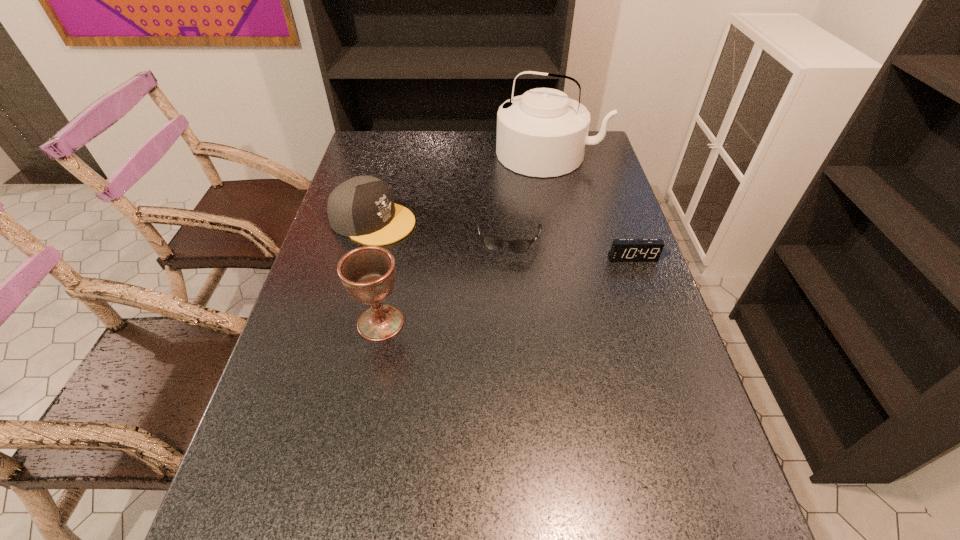
Where is `free space on the desktop that is between the chalice and the alarm clock and is positioned on the front-facing side of the cap`? free space on the desktop that is between the chalice and the alarm clock and is positioned on the front-facing side of the cap is located at coordinates (540, 281).

I want to click on vacant space on the desktop that is between the chalice and the alarm clock and is positioned on the spout of the farthest object, so click(x=486, y=296).

Identify the location of vacant space on the desktop that is between the nearest object and the alarm clock and is positioned on the front-facing side of the sunglasses. This screenshot has width=960, height=540. (500, 292).